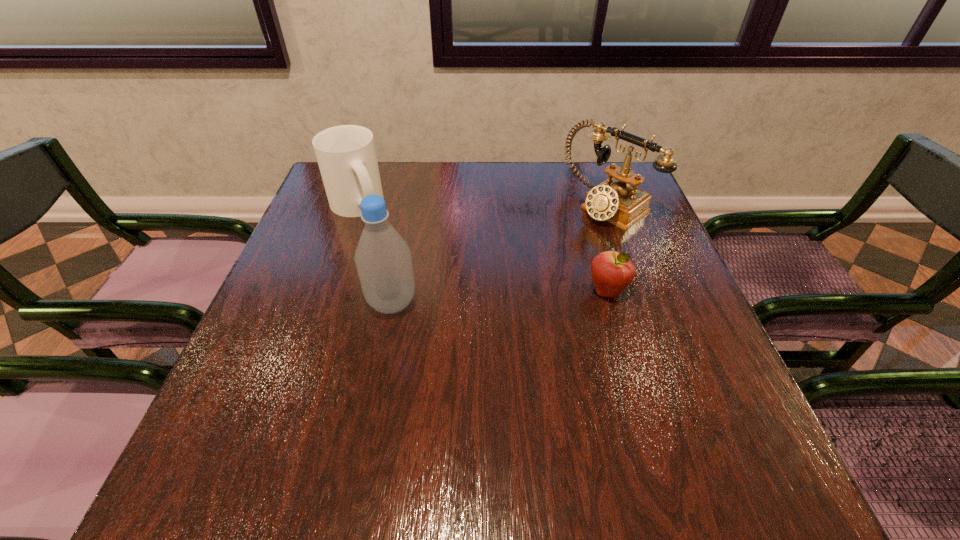
Locate an element on the screen. The width and height of the screenshot is (960, 540). vacant space situated 0.140m on the handle side of the third tallest object is located at coordinates (403, 245).

The width and height of the screenshot is (960, 540). Identify the location of vacant space situated 0.360m on the dial number of the third shortest object. (483, 292).

The width and height of the screenshot is (960, 540). Identify the location of vacant region located on the dial number of the third shortest object. (505, 276).

The width and height of the screenshot is (960, 540). Identify the location of vacant space located on the dial number of the third shortest object. (476, 296).

The image size is (960, 540). Identify the location of mug that is at the far edge. (346, 155).

Locate an element on the screen. This screenshot has width=960, height=540. telephone located in the far edge section of the desktop is located at coordinates (614, 200).

This screenshot has width=960, height=540. I want to click on object that is at the left edge, so click(x=346, y=155).

Find the location of `apple located at the right edge`. apple located at the right edge is located at coordinates [612, 272].

Image resolution: width=960 pixels, height=540 pixels. Find the location of `telephone at the right edge`. telephone at the right edge is located at coordinates (614, 200).

Identify the location of object at the far left corner. This screenshot has width=960, height=540. (346, 155).